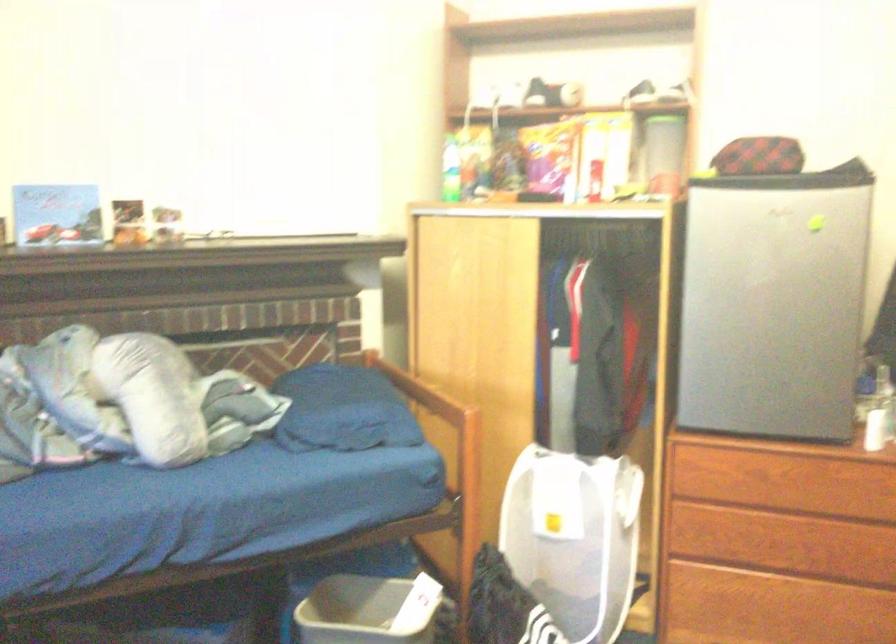
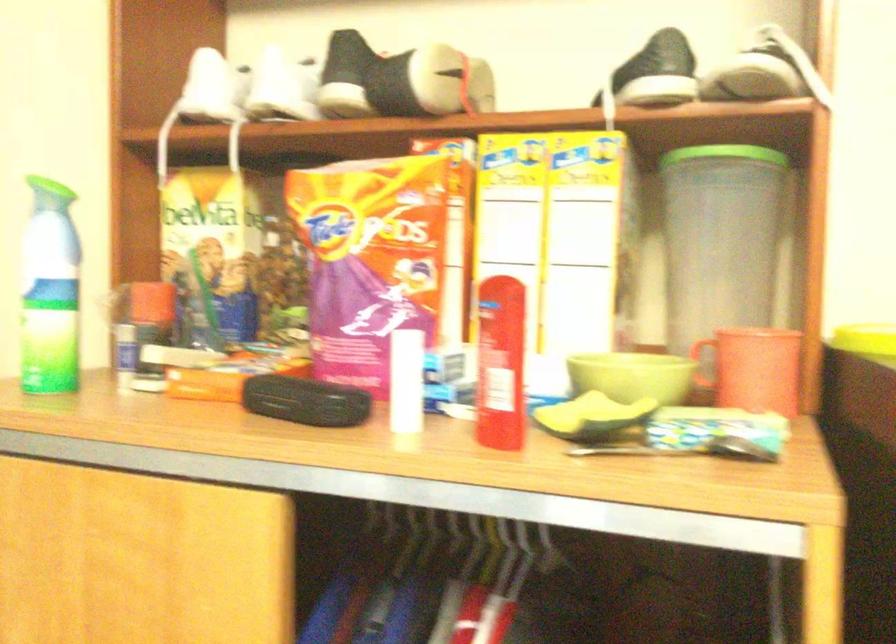
The point at (x=451, y=169) is marked in the first image. Where is the corresponding point in the second image?

(49, 292)